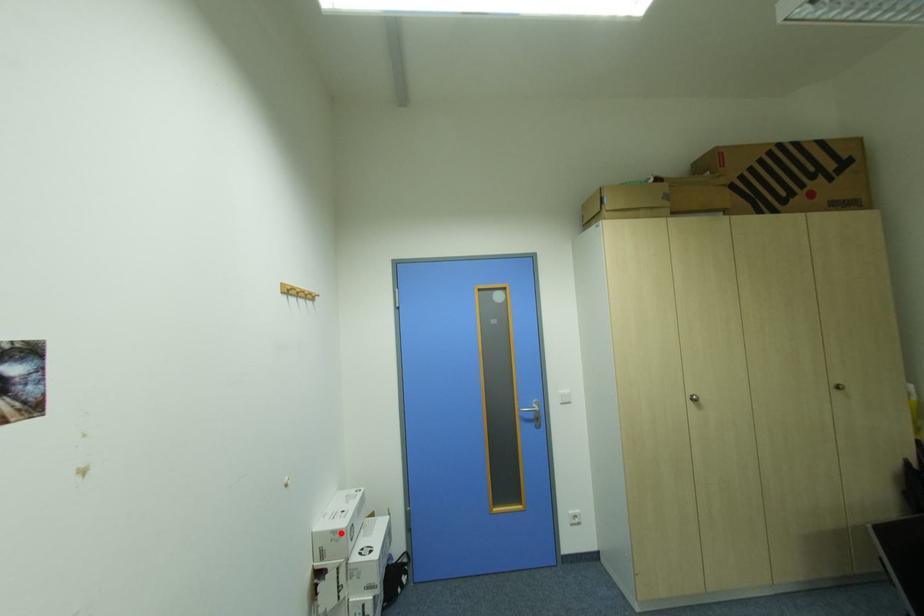
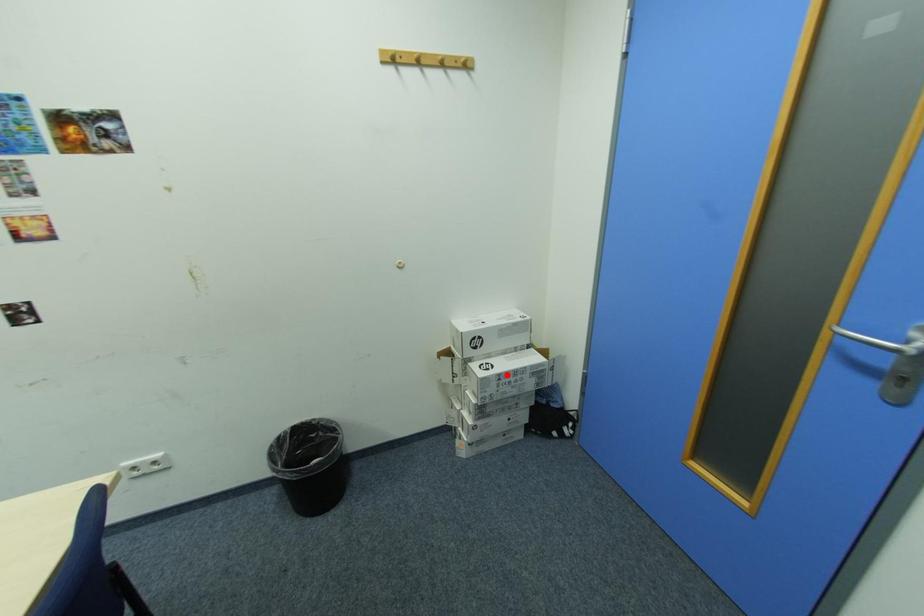
I am providing you with two images of the same scene from different viewpoints. A red point is marked on the first image and another point is marked on the second image. Are the points marked in image1 and image2 representing the same 3D position?

No